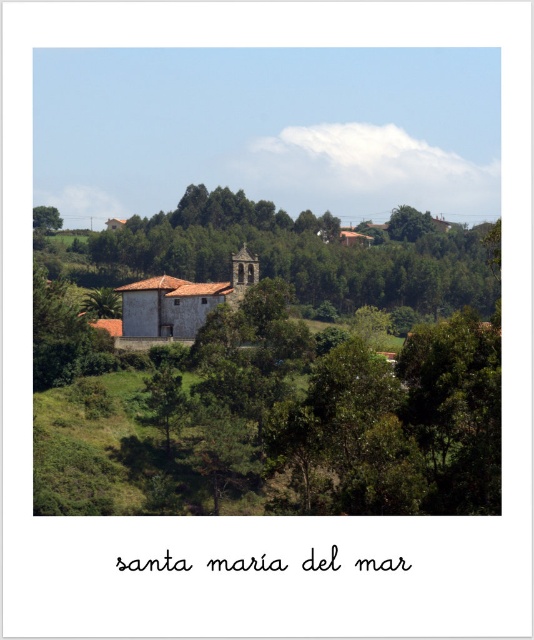
Question: Does green leafy tree at center come behind brown wooden church at center?

Choices:
 (A) yes
 (B) no

Answer: (B)

Question: Does green leafy tree at center appear on the right side of brown wooden church at center?

Choices:
 (A) no
 (B) yes

Answer: (B)

Question: Which point is farther to the camera?

Choices:
 (A) (230, 468)
 (B) (208, 291)

Answer: (B)

Question: Which point appears closest to the camera in this image?

Choices:
 (A) (240, 275)
 (B) (404, 451)

Answer: (B)

Question: Is green leafy tree at center to the right of brown wooden church at center from the viewer's perspective?

Choices:
 (A) yes
 (B) no

Answer: (A)